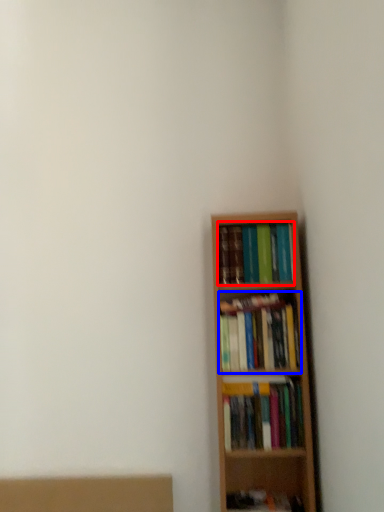
Question: Which object is further to the camera taking this photo, book (highlighted by a red box) or book (highlighted by a blue box)?

Choices:
 (A) book
 (B) book

Answer: (A)